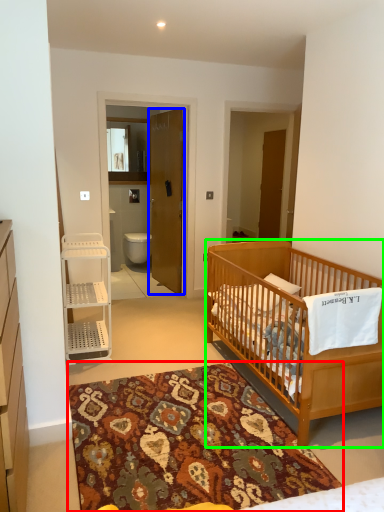
Question: Considering the real-world distances, which object is closest to mat (highlighted by a red box)? door (highlighted by a blue box) or infant bed (highlighted by a green box).

Choices:
 (A) door
 (B) infant bed

Answer: (B)